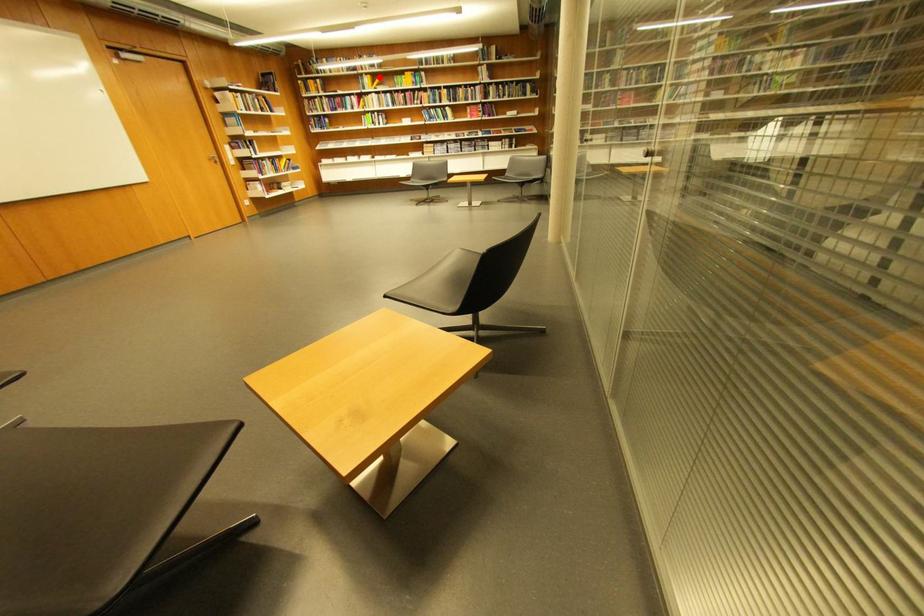
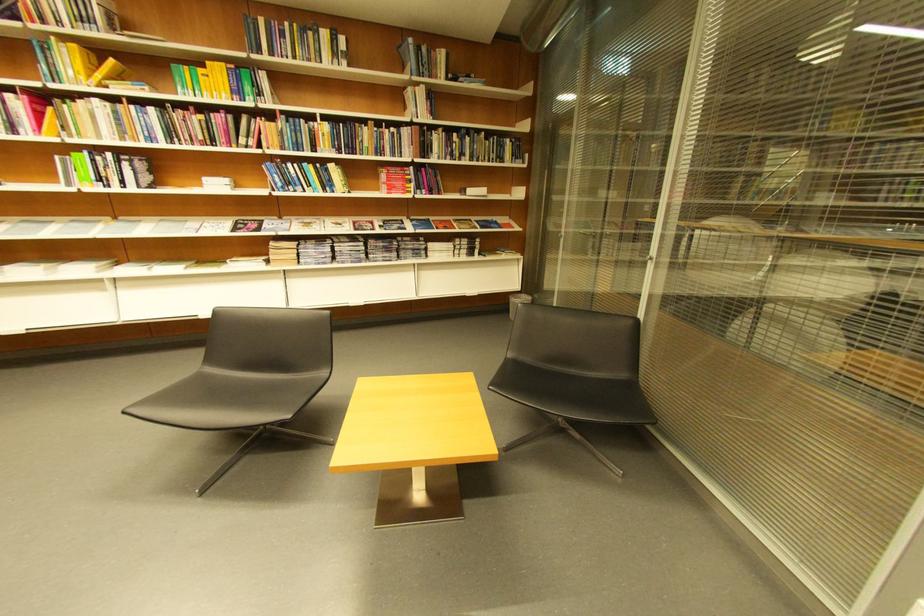
In the second image, find the point that corresponds to the highlighted location in the first image.

(84, 47)